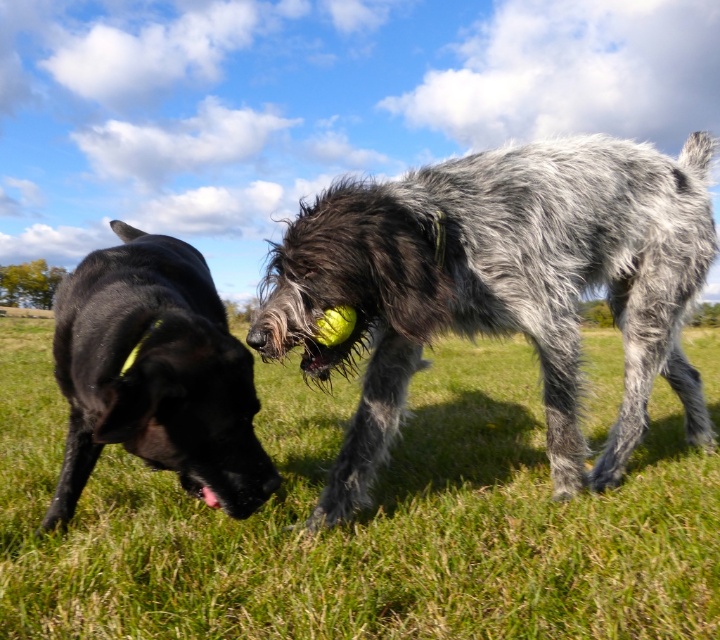
You are standing in the field and want to throw a frisbee to the point marked at coordinates point (418, 374). If your throwing range is 30 feet, can you reach that point?

The point (418, 374) is 27.68 feet away from the viewer, so yes, you can reach it since it is within your 30 feet throwing range.